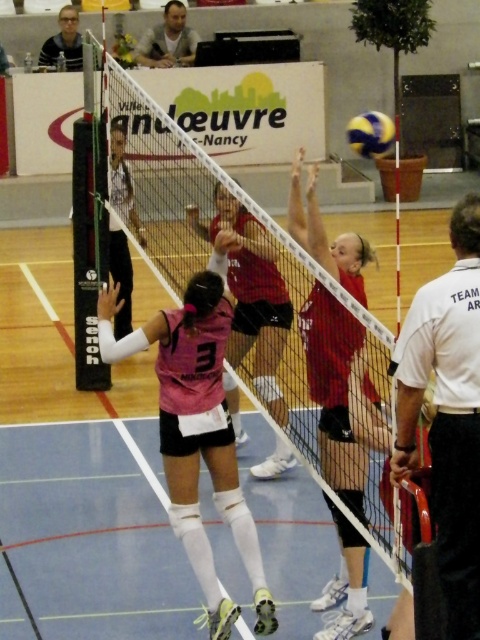
Does point (462, 230) come farther from viewer compared to point (196, 294)?

No, (462, 230) is in front of (196, 294).

Can you confirm if white shirt at right is bigger than pink jersey at center?

Actually, white shirt at right might be smaller than pink jersey at center.

This screenshot has height=640, width=480. I want to click on white shirt at right, so click(447, 413).

Is white shirt at right above yellow matte volleyball at upper center?

Incorrect, white shirt at right is not positioned above yellow matte volleyball at upper center.

Where is `white shirt at right`? white shirt at right is located at coordinates (447, 413).

Is white mesh net at center wider than pink matte/vinyl jersey at center?

Yes, white mesh net at center is wider than pink matte/vinyl jersey at center.

Does white mesh net at center appear on the right side of pink matte/vinyl jersey at center?

Incorrect, white mesh net at center is not on the right side of pink matte/vinyl jersey at center.

Who is more forward, (172, 132) or (214, 257)?

Positioned in front is point (214, 257).

Image resolution: width=480 pixels, height=640 pixels. Find the location of `white mesh net at center`. white mesh net at center is located at coordinates (285, 326).